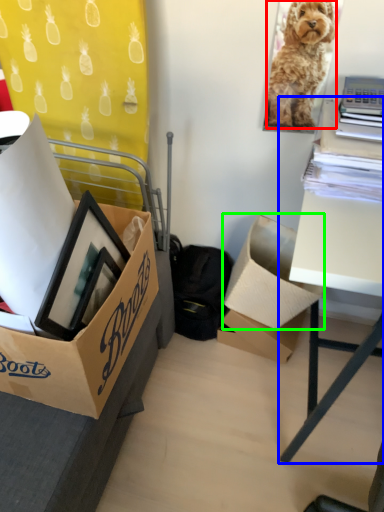
Question: Which object is positioned closest to dog (highlighted by a red box)? Select from table (highlighted by a blue box) and box (highlighted by a green box).

Choices:
 (A) table
 (B) box

Answer: (A)